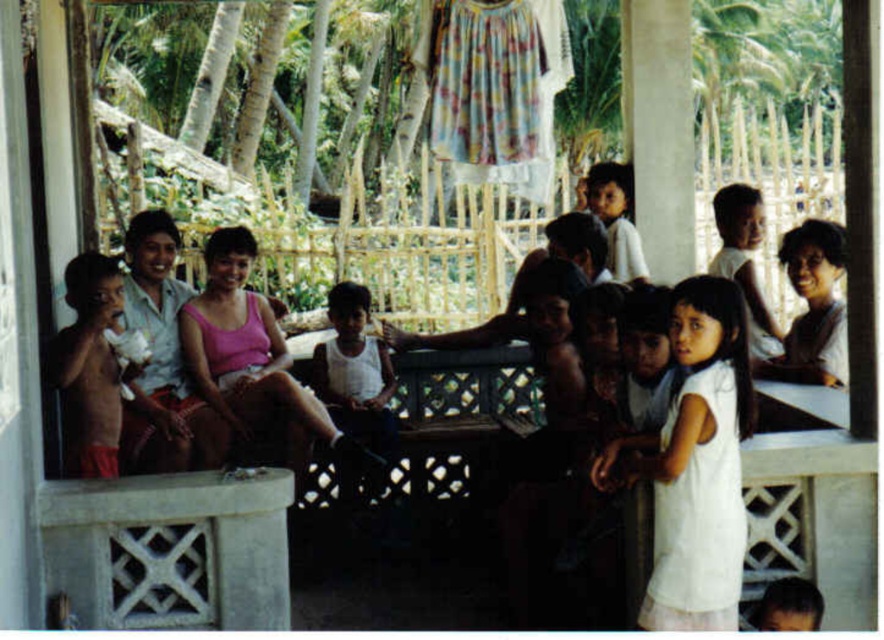
Who is positioned more to the left, white cotton dress at lower right or light brown skin at upper right?

From the viewer's perspective, white cotton dress at lower right appears more on the left side.

Does white cotton dress at lower right appear on the left side of light brown skin at upper right?

Yes, white cotton dress at lower right is to the left of light brown skin at upper right.

Which is in front, point (713, 465) or point (755, 284)?

Point (713, 465) is in front.

This screenshot has width=884, height=640. I want to click on white cotton dress at lower right, so click(696, 465).

Does point (707, 301) lie behind point (820, 356)?

No, (707, 301) is in front of (820, 356).

Who is more forward, [682,364] or [786,364]?

Point [682,364] is more forward.

The width and height of the screenshot is (884, 640). In order to click on white cotton dress at lower right in this screenshot , I will do `click(696, 465)`.

Does smooth white shirt at right come in front of light brown skin at upper right?

That is True.

Does smooth white shirt at right appear on the right side of light brown skin at upper right?

Correct, you'll find smooth white shirt at right to the right of light brown skin at upper right.

What do you see at coordinates (814, 307) in the screenshot?
I see `smooth white shirt at right` at bounding box center [814, 307].

Where is `smooth white shirt at right`? The image size is (884, 640). smooth white shirt at right is located at coordinates (814, 307).